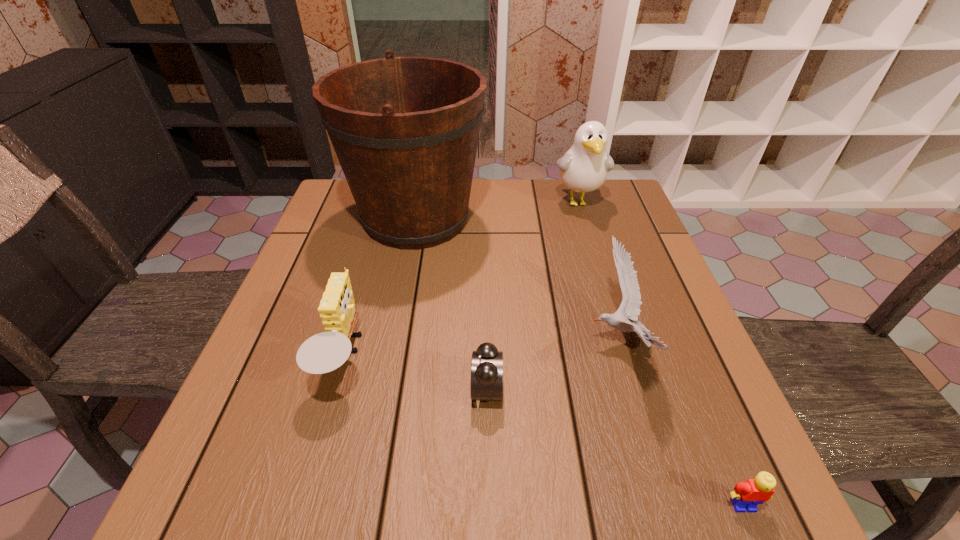
Find the location of a particular element. This screenshot has height=540, width=960. bucket is located at coordinates (405, 130).

Identify the location of the fifth shortest object. (584, 168).

Identify the location of the farther gull. The image size is (960, 540). pos(584,168).

Find the location of a particular element. This screenshot has width=960, height=540. the shorter gull is located at coordinates (630, 306).

The height and width of the screenshot is (540, 960). What are the coordinates of `sponge` in the screenshot? It's located at (324, 352).

Where is `alarm clock`? alarm clock is located at coordinates (486, 380).

The width and height of the screenshot is (960, 540). What are the coordinates of `Lego` in the screenshot? It's located at (747, 495).

At what (x,y) coordinates should I click in order to perform the action: click on the nearest object. Please return your answer as a coordinate pair (x, y). Looking at the image, I should click on (747, 495).

The height and width of the screenshot is (540, 960). Find the location of `vacant space located 0.290m on the front of the bucket`. vacant space located 0.290m on the front of the bucket is located at coordinates (390, 360).

Locate an element on the screen. The width and height of the screenshot is (960, 540). free location located 0.190m on the beak of the farther gull is located at coordinates (598, 265).